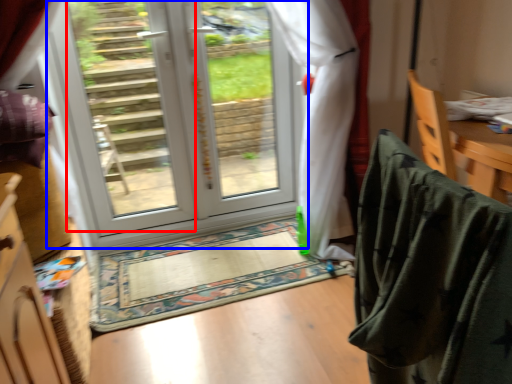
Question: Which of the following is the farthest to the observer, glass door (highlighted by a red box) or door (highlighted by a blue box)?

Choices:
 (A) glass door
 (B) door

Answer: (B)